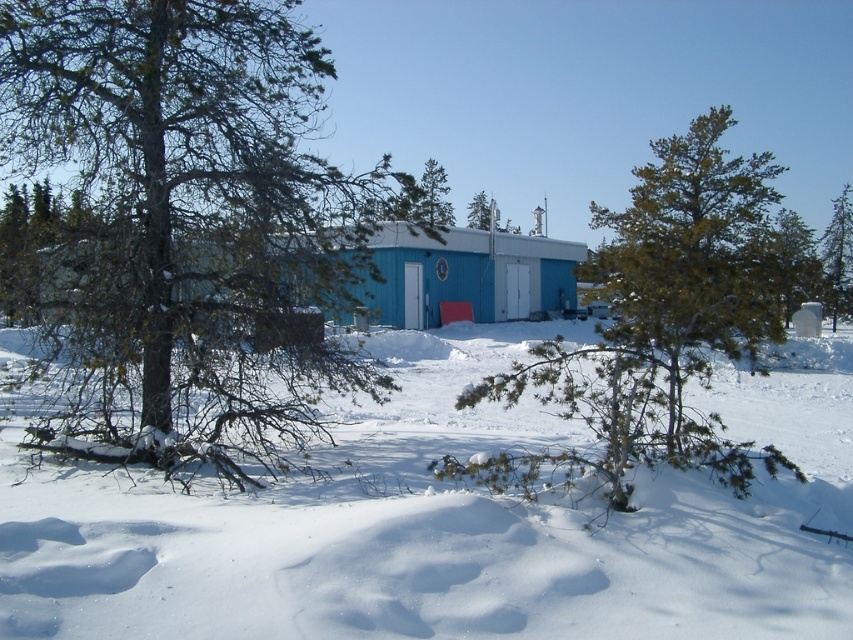
Looking at this image, you are standing in the winter scene described. You want to place a small decorative snowman exactly at the center of the image. Is the white fluffy snow at center located at the correct position for this purpose?

The white fluffy snow at center is located at point (444, 529), which is not the exact center of the image. The exact center would be at point (426, 320). Therefore, the snowman should be placed at the true center rather than where the white fluffy snow at center is located.

You are standing at the point marked as point (444,529) in the winter scene. What is under your feet?

The point (444,529) is on white fluffy snow at center, so the ground under your feet is white fluffy snow.

You are standing in front of the winter scene with the bright blue building. There are two points marked on the image at coordinates point (706,556) and point (827,310). Which of these two points is nearer to your viewpoint?

Point (706,556) is closer to the camera than point (827,310), so the point at (706,556) is nearer to your viewpoint.